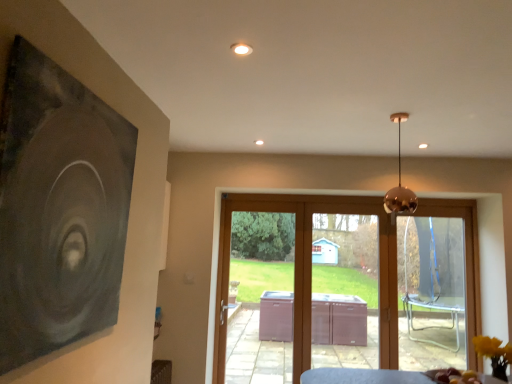
Question: From a real-world perspective, relative to brown wood screen door at center, is brown wooden door at center vertically above or below?

Choices:
 (A) below
 (B) above

Answer: (A)

Question: Does point (425, 220) appear closer or farther from the camera than point (323, 289)?

Choices:
 (A) closer
 (B) farther

Answer: (B)

Question: Considering the real-world distances, which object is farthest from the brown wood screen door at center?

Choices:
 (A) brown wooden door at center
 (B) copper reflective pendant light at upper center
 (C) dark matte painting at left

Answer: (C)

Question: Estimate the real-world distances between objects in this image. Which object is closer to the dark matte painting at left?

Choices:
 (A) brown wooden door at center
 (B) copper reflective pendant light at upper center
 (C) brown wood screen door at center

Answer: (B)